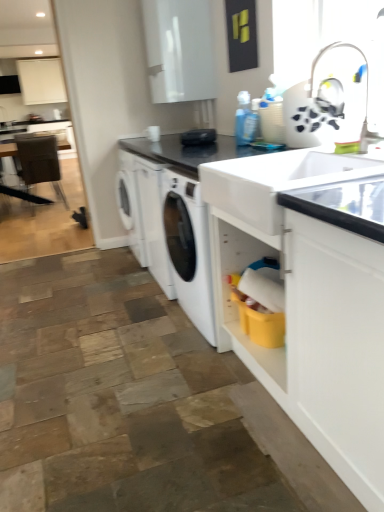
Question: Could brown leather chair at left be considered to be inside white glossy sink at center?

Choices:
 (A) no
 (B) yes

Answer: (A)

Question: Considering the relative sizes of white glossy sink at center and brown leather chair at left in the image provided, is white glossy sink at center bigger than brown leather chair at left?

Choices:
 (A) no
 (B) yes

Answer: (A)

Question: Can we say white glossy sink at center lies outside brown leather chair at left?

Choices:
 (A) yes
 (B) no

Answer: (A)

Question: Can you confirm if white glossy sink at center is wider than brown leather chair at left?

Choices:
 (A) yes
 (B) no

Answer: (B)

Question: Is the depth of white glossy sink at center less than that of brown leather chair at left?

Choices:
 (A) no
 (B) yes

Answer: (B)

Question: Is point (203, 136) positioned closer to the camera than point (357, 259)?

Choices:
 (A) closer
 (B) farther

Answer: (B)

Question: Considering the positions of black matte toaster at center and black matte sink at lower right, the 2th countertop from the top, in the image, is black matte toaster at center wider or thinner than black matte sink at lower right, the 2th countertop from the top,?

Choices:
 (A) wide
 (B) thin

Answer: (B)

Question: Would you say black matte toaster at center is to the left or to the right of black matte sink at lower right, the 2th countertop from the top, in the picture?

Choices:
 (A) right
 (B) left

Answer: (B)

Question: Looking at the image, does black matte toaster at center seem bigger or smaller compared to black matte sink at lower right, the first countertop from the bottom?

Choices:
 (A) big
 (B) small

Answer: (B)

Question: Is black matte toaster at center wider or thinner than white plastic faucet at upper right?

Choices:
 (A) thin
 (B) wide

Answer: (A)

Question: Considering the positions of black matte toaster at center and white plastic faucet at upper right in the image, is black matte toaster at center bigger or smaller than white plastic faucet at upper right?

Choices:
 (A) small
 (B) big

Answer: (A)

Question: Does point (188, 136) appear closer or farther from the camera than point (350, 118)?

Choices:
 (A) closer
 (B) farther

Answer: (B)

Question: Is black matte toaster at center in front of or behind white plastic faucet at upper right in the image?

Choices:
 (A) behind
 (B) front

Answer: (A)

Question: Is point click(321, 91) closer or farther from the camera than point click(203, 51)?

Choices:
 (A) farther
 (B) closer

Answer: (B)

Question: Is white plastic faucet at upper right wider or thinner than white glossy cabinet at upper center, marked as the 2th cabinetry in a back-to-front arrangement?

Choices:
 (A) thin
 (B) wide

Answer: (A)